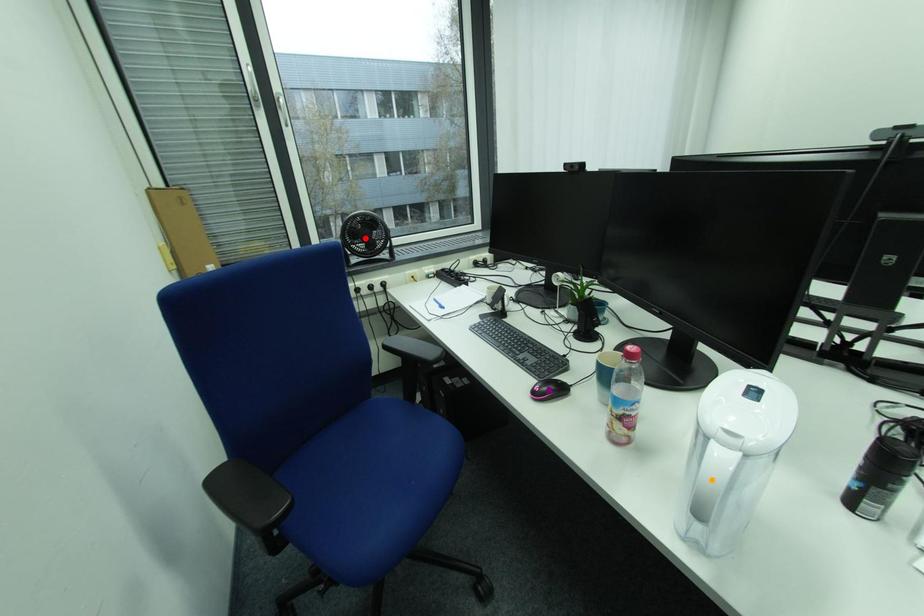
Order these from nearest to farthest:
orange point | purple point | red point

orange point, purple point, red point